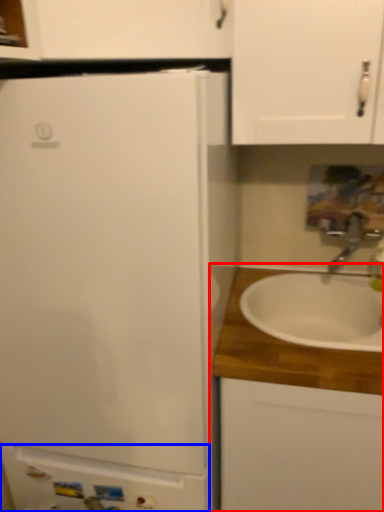
Question: Which point is further to the camera, cabinetry (highlighted by a red box) or cabinetry (highlighted by a blue box)?

Choices:
 (A) cabinetry
 (B) cabinetry

Answer: (B)